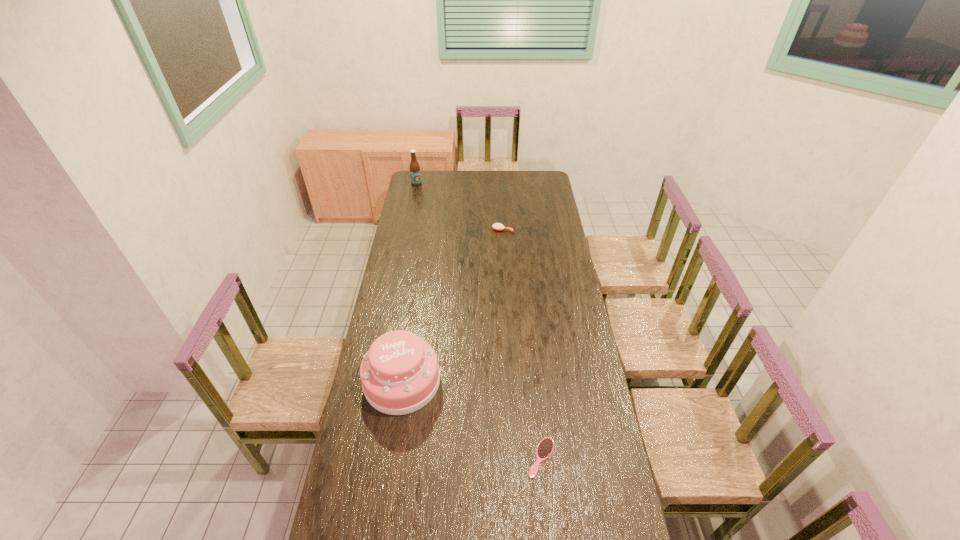
This screenshot has width=960, height=540. In order to click on vacant space that's between the shortest object and the third tallest object in this screenshot , I will do `click(522, 344)`.

Locate an element on the screen. The width and height of the screenshot is (960, 540). free spot between the farther hairbrush and the farthest object is located at coordinates (460, 207).

This screenshot has width=960, height=540. Identify the location of unoccupied area between the farthest object and the third nearest object. (460, 207).

Where is `free space between the birthday cake and the shorter hairbrush`? free space between the birthday cake and the shorter hairbrush is located at coordinates (471, 420).

The height and width of the screenshot is (540, 960). What are the coordinates of `free space between the nearer hairbrush and the birthday cake` in the screenshot? It's located at (471, 420).

Find the location of a particular element. This screenshot has height=540, width=960. free space that is in between the third farthest object and the taller hairbrush is located at coordinates (452, 306).

Where is `free space between the third tallest object and the farthest object`? The width and height of the screenshot is (960, 540). free space between the third tallest object and the farthest object is located at coordinates (460, 207).

Find the location of a particular element. Image resolution: width=960 pixels, height=540 pixels. free space between the farthest object and the third nearest object is located at coordinates pyautogui.click(x=460, y=207).

Identify which object is located as the nearest to the second tallest object. Please provide its 2D coordinates. Your answer should be formatted as a tuple, i.e. [(x, y)], where the tuple contains the x and y coordinates of a point satisfying the conditions above.

[(545, 448)]

You are a GUI agent. You are given a task and a screenshot of the screen. Output one action in this format:
    pyautogui.click(x=<x>, y=<y>)
    Task: Click on the second closest object relative to the farther hairbrush
    The image size is (960, 540).
    Given the screenshot: What is the action you would take?
    pyautogui.click(x=400, y=374)